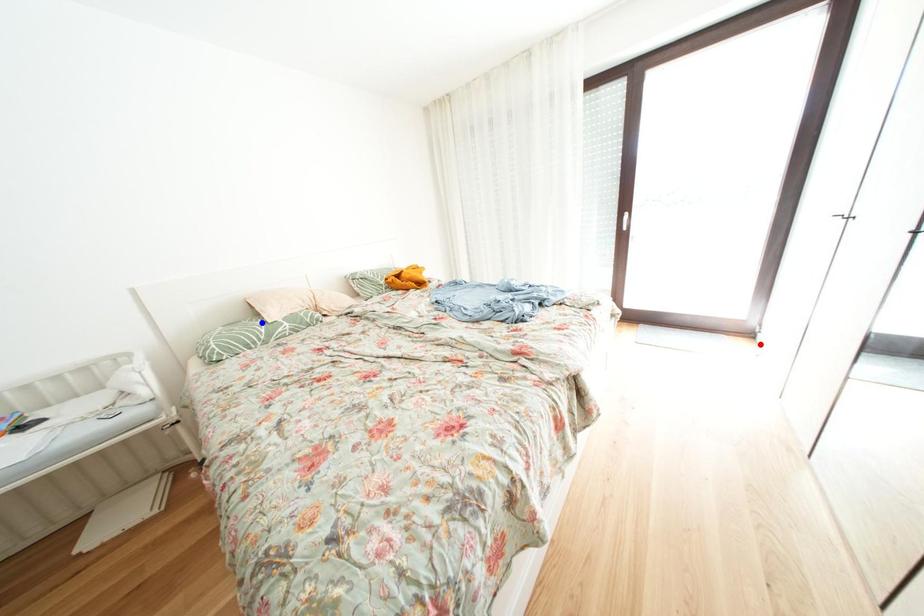
Question: In the image, two points are highlighted. Which point is nearer to the camera? Reply with the corresponding letter.

Choices:
 (A) blue point
 (B) red point

Answer: (A)